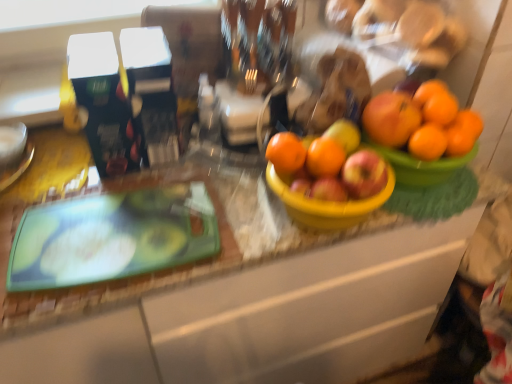
Locate an element on the screen. The width and height of the screenshot is (512, 384). free space above green glossy cutting board at left (from a real-world perspective) is located at coordinates (110, 233).